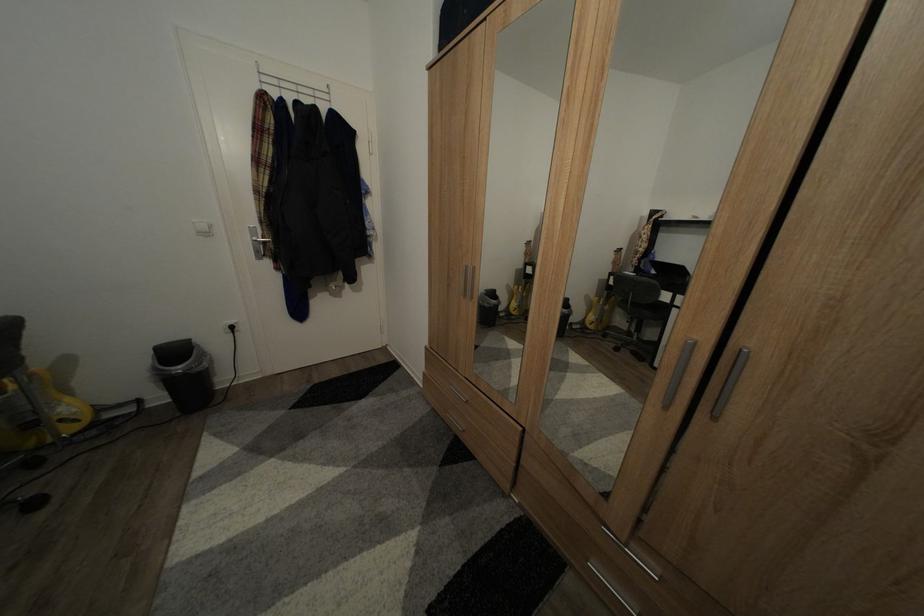
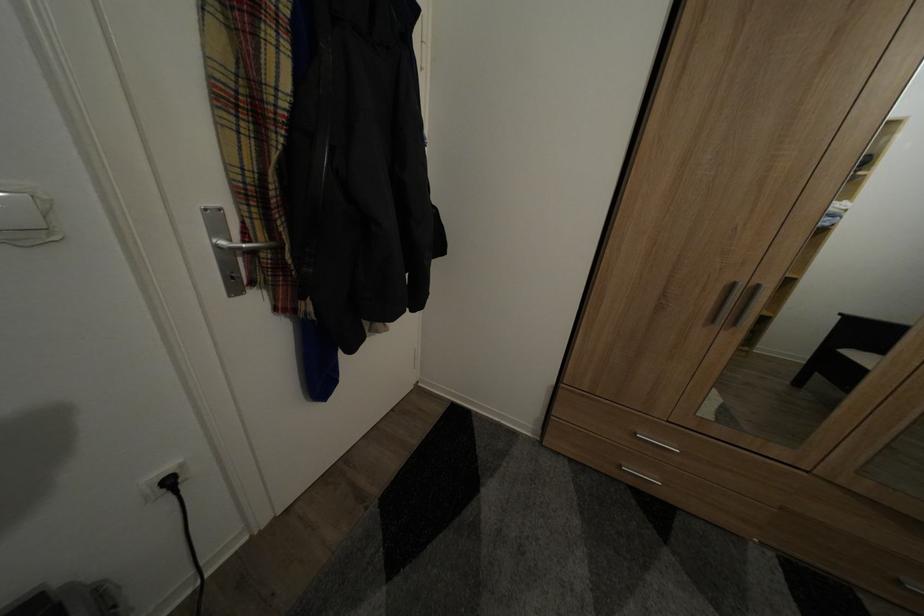
The images are taken continuously from a first-person perspective. In which direction are you moving?

The cameraman walked toward left, forward.